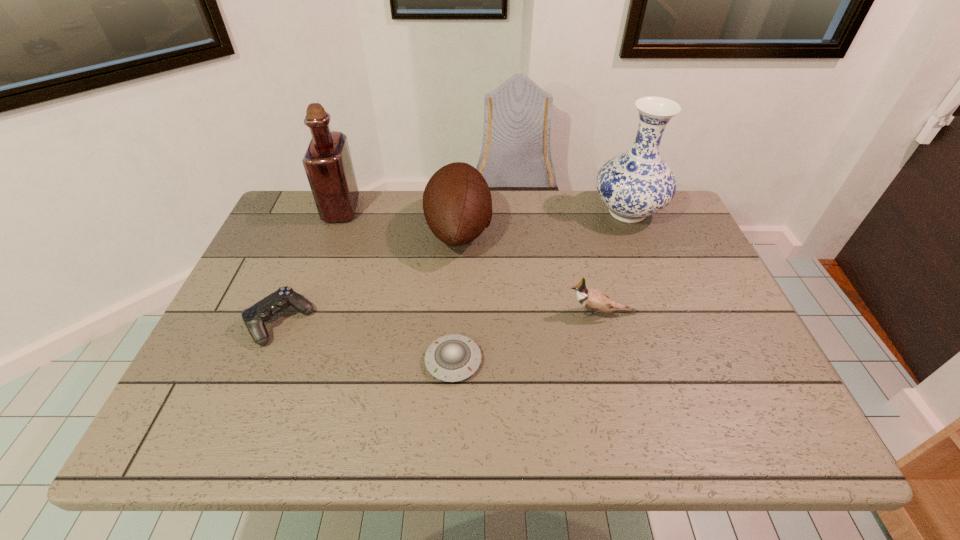
You are a GUI agent. You are given a task and a screenshot of the screen. Output one action in this format:
    pyautogui.click(x=<x>, y=<y>)
    Task: Click on the vase
    The width and height of the screenshot is (960, 540).
    Given the screenshot: What is the action you would take?
    pyautogui.click(x=635, y=184)

This screenshot has width=960, height=540. What are the coordinates of `liquor` in the screenshot? It's located at click(x=327, y=162).

At what (x,y) coordinates should I click in order to perform the action: click on the third tallest object. Please return your answer as a coordinate pair (x, y). This screenshot has width=960, height=540. Looking at the image, I should click on (457, 204).

The width and height of the screenshot is (960, 540). I want to click on the fourth tallest object, so click(x=595, y=300).

Locate an element on the screen. This screenshot has height=540, width=960. the second shortest object is located at coordinates (254, 317).

Locate an element on the screen. Image resolution: width=960 pixels, height=540 pixels. the shortest object is located at coordinates (451, 358).

Find the location of `free space located 0.280m on the left of the vase`. free space located 0.280m on the left of the vase is located at coordinates (501, 212).

The height and width of the screenshot is (540, 960). Find the location of `free space located 0.170m on the right of the liquor`. free space located 0.170m on the right of the liquor is located at coordinates (413, 210).

You are a GUI agent. You are given a task and a screenshot of the screen. Output one action in this format:
    pyautogui.click(x=<x>, y=<y>)
    Task: Click on the vacant space situated on the laces of the football
    
    Given the screenshot: What is the action you would take?
    pyautogui.click(x=583, y=230)

Locate an element on the screen. Image resolution: width=960 pixels, height=540 pixels. free point located at the face of the bird is located at coordinates (495, 313).